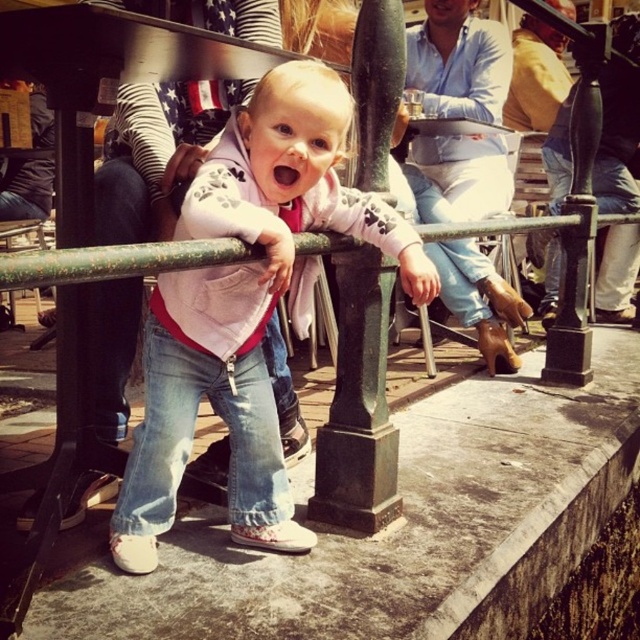
Can you confirm if white matte jacket at center is wider than matte blue jeans at center?

Yes, white matte jacket at center is wider than matte blue jeans at center.

Which of these two, white matte jacket at center or matte blue jeans at center, stands shorter?

white matte jacket at center is shorter.

At what (x,y) coordinates should I click in order to perform the action: click on white matte jacket at center. Please return your answer as a coordinate pair (x, y). Looking at the image, I should click on (248, 307).